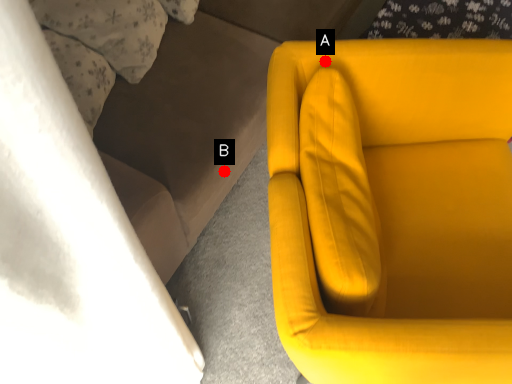
Question: Two points are circled on the image, labeled by A and B beside each circle. Which point appears closest to the camera in this image?

Choices:
 (A) A is closer
 (B) B is closer

Answer: (A)